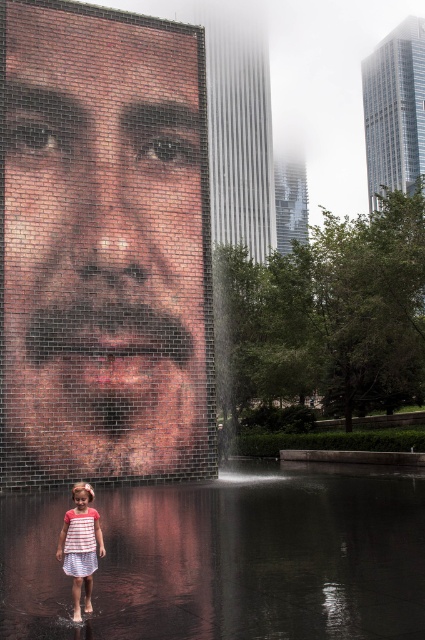
Question: Can you confirm if striped cotton dress at lower left is smaller than white striped dress at lower left?

Choices:
 (A) yes
 (B) no

Answer: (B)

Question: From the image, what is the correct spatial relationship of brick mosaic face at center in relation to white striped dress at lower left?

Choices:
 (A) right
 (B) left

Answer: (B)

Question: Which of these objects is positioned closest to the clear water at center?

Choices:
 (A) brick mosaic face at center
 (B) white striped dress at lower left

Answer: (B)

Question: Is striped cotton dress at lower left below white striped dress at lower left?

Choices:
 (A) yes
 (B) no

Answer: (A)

Question: Estimate the real-world distances between objects in this image. Which object is closer to the striped cotton dress at lower left?

Choices:
 (A) white striped dress at lower left
 (B) clear water at center
 (C) brick mosaic face at center

Answer: (A)

Question: Which point is closer to the camera taking this photo?

Choices:
 (A) (405, 520)
 (B) (74, 605)
 (C) (73, 545)

Answer: (B)